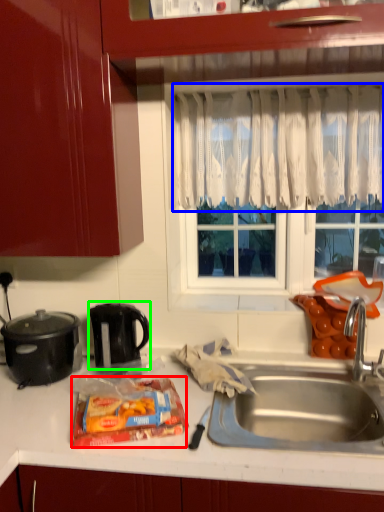
Question: Which object is the farthest from snack (highlighted by a red box)? Choose among these: curtain (highlighted by a blue box) or kitchen appliance (highlighted by a green box).

Choices:
 (A) curtain
 (B) kitchen appliance

Answer: (A)